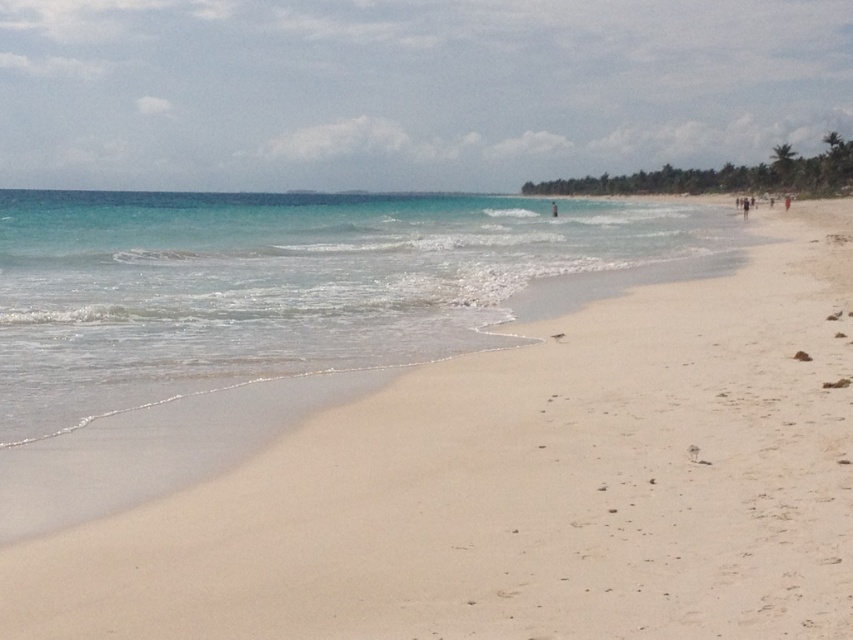
You are standing on the beach and want to place a small bucket exactly between the clear blue water at center and the light blue fabric person at center. Which object will the bucket be closer to, and why?

The bucket will be closer to the light blue fabric person at center because the clear blue water at center is wider than the light blue fabric person at center, so the midpoint between them would be nearer to the narrower object.

You are a photographer standing on the beach and want to capture a photo of the clear blue water at center and the light blue fabric person at center. Which object should you focus on first if you want to ensure both are in the frame without moving the camera?

The clear blue water at center is taller than the light blue fabric person at center, so you should focus on the clear blue water at center first to ensure it fits within the frame before adjusting for the lighter object.